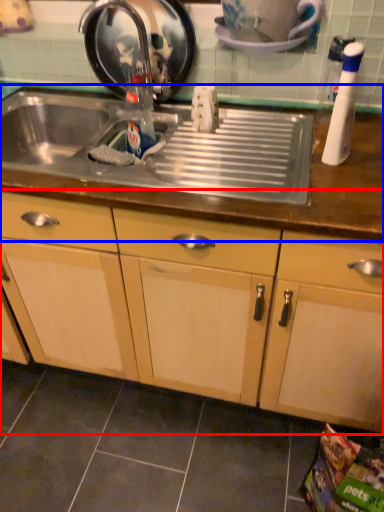
Question: Among these objects, which one is nearest to the camera, cabinetry (highlighted by a red box) or countertop (highlighted by a blue box)?

Choices:
 (A) cabinetry
 (B) countertop

Answer: (A)